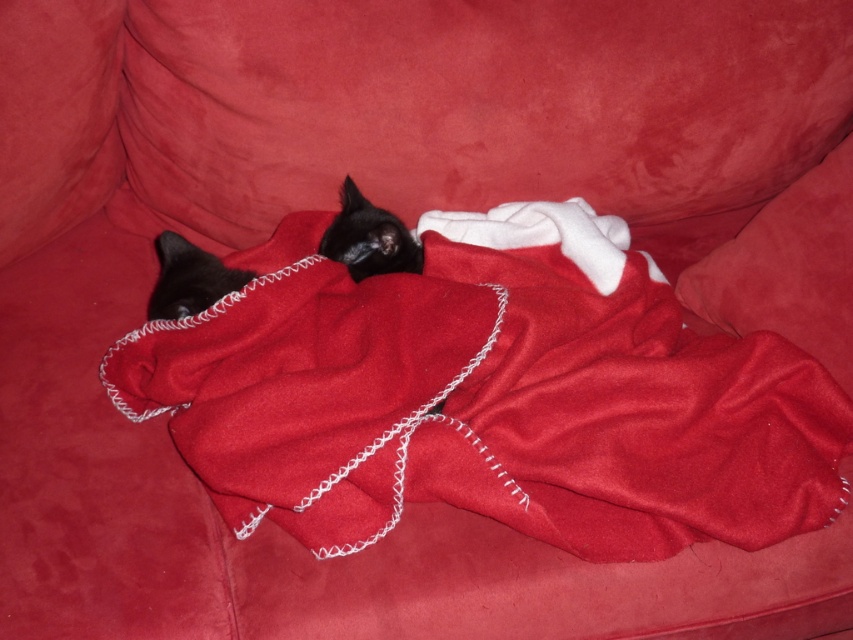
You are trying to place a small toy for the black cat on the couch. The velvet cushion at center is located at point (788,268). Where should you place the toy so that it is directly above the velvet cushion at center?

You should place the toy at point (788,268) directly above the velvet cushion at center.

You are a photographer setting up a shot of the velvet cushion at center and the matte black cat at left. Which object should you focus on first to ensure both are in sharp focus?

The velvet cushion at center is closer to the viewer than the matte black cat at left, so you should focus on the velvet cushion at center first to ensure both are in sharp focus.

You are a photographer setting up a shot of the black matte fur cat at center and the velvet cushion at center. You need to ensure that the taller object is placed in the background for depth. Which object should be positioned further back?

The velvet cushion at center is taller than the black matte fur cat at center, so the velvet cushion at center should be positioned further back to create depth.